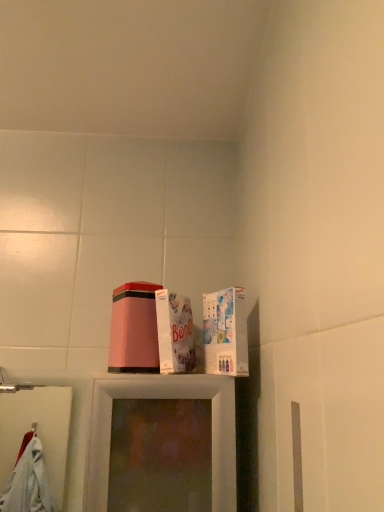
Question: Could white cardboard box at center, the 2th box in the right-to-left sequence, be considered to be inside white cardboard box at upper right, which is the 2th box from left to right?

Choices:
 (A) no
 (B) yes

Answer: (A)

Question: From the image's perspective, is white cardboard box at upper right, which is the 2th box from left to right, above white cardboard box at center, the 2th box in the right-to-left sequence?

Choices:
 (A) no
 (B) yes

Answer: (A)

Question: Is white cardboard box at upper right, which is the 2th box from left to right, to the left of white cardboard box at center, the 2th box in the right-to-left sequence, from the viewer's perspective?

Choices:
 (A) no
 (B) yes

Answer: (A)

Question: Is white cardboard box at upper right, the 1th box in the right-to-left sequence, further to the viewer compared to white cardboard box at center, which is the 1th box in left-to-right order?

Choices:
 (A) no
 (B) yes

Answer: (A)

Question: Is white cardboard box at upper right, which is the 2th box from left to right, next to white cardboard box at center, the 2th box in the right-to-left sequence, and touching it?

Choices:
 (A) no
 (B) yes

Answer: (B)

Question: Are white cardboard box at upper right, the 1th box in the right-to-left sequence, and white cardboard box at center, the 2th box in the right-to-left sequence, located far from each other?

Choices:
 (A) yes
 (B) no

Answer: (B)

Question: Is white cardboard box at center, the 2th box in the right-to-left sequence, not close to white cardboard box at upper right, which is the 2th box from left to right?

Choices:
 (A) no
 (B) yes

Answer: (A)

Question: Can you confirm if white cardboard box at center, the 2th box in the right-to-left sequence, is smaller than white cardboard box at upper right, the 1th box in the right-to-left sequence?

Choices:
 (A) yes
 (B) no

Answer: (B)

Question: Does white cardboard box at center, the 2th box in the right-to-left sequence, have a lesser height compared to white cardboard box at upper right, the 1th box in the right-to-left sequence?

Choices:
 (A) no
 (B) yes

Answer: (A)

Question: Considering the relative positions of white cardboard box at center, the 2th box in the right-to-left sequence, and white cardboard box at upper right, the 1th box in the right-to-left sequence, in the image provided, is white cardboard box at center, the 2th box in the right-to-left sequence, in front of white cardboard box at upper right, the 1th box in the right-to-left sequence,?

Choices:
 (A) yes
 (B) no

Answer: (B)

Question: Does white cardboard box at center, which is the 1th box in left-to-right order, have a larger size compared to white cardboard box at upper right, which is the 2th box from left to right?

Choices:
 (A) yes
 (B) no

Answer: (A)

Question: Does white cardboard box at center, which is the 1th box in left-to-right order, have a greater width compared to white cardboard box at upper right, the 1th box in the right-to-left sequence?

Choices:
 (A) yes
 (B) no

Answer: (A)

Question: From the image's perspective, is white cardboard box at upper right, the 1th box in the right-to-left sequence, above or below white cardboard box at center, the 2th box in the right-to-left sequence?

Choices:
 (A) below
 (B) above

Answer: (A)